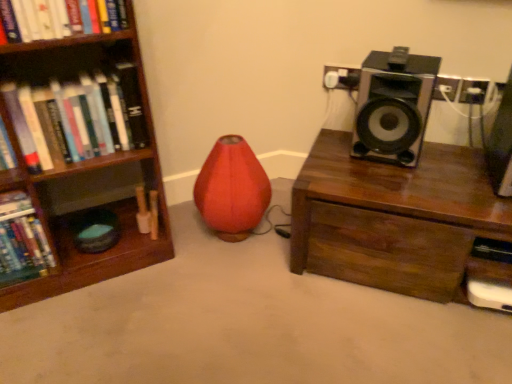
Image resolution: width=512 pixels, height=384 pixels. I want to click on unoccupied area in front of brown wooden chest at right, so click(410, 336).